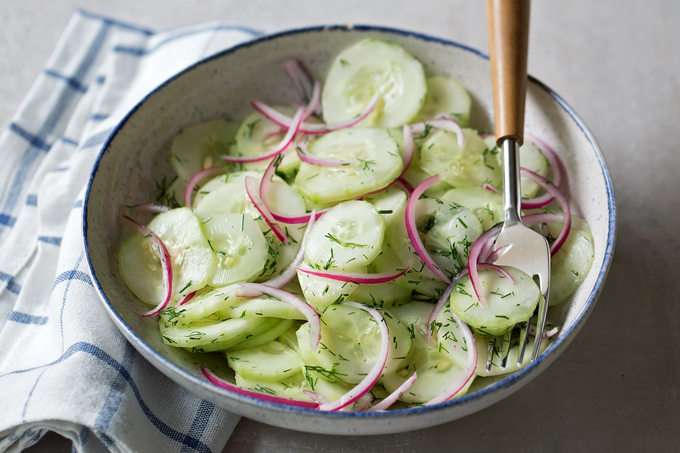
Identify the location of blue rim of bowl. The width and height of the screenshot is (680, 453). (199, 380).